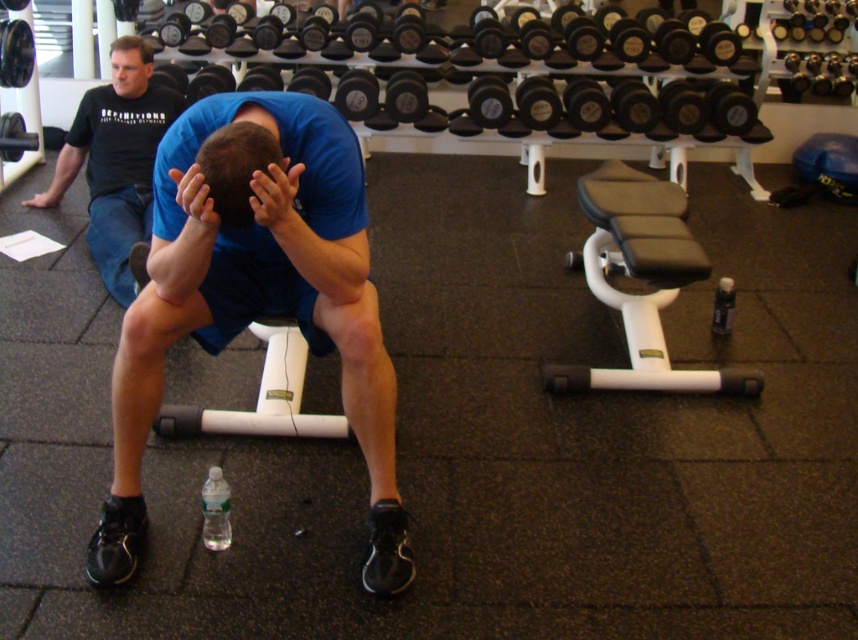
You are standing in the gym and want to place a new piece of equipment between the two points labeled as point (119, 154) and point (35, 200). Which point should the equipment be closer to if it needs to be nearer to the viewer?

The equipment should be closer to point (119, 154) since it is closer to the viewer than point (35, 200).

You are a gym trainer assessing the image. You see the black cotton shirt at upper left and the matte black hand at upper left. Which object is positioned higher in the image?

The black cotton shirt at upper left is taller than the matte black hand at upper left, so the black cotton shirt at upper left is positioned higher in the image.

You are a gym trainer assessing a client. You notice the smooth skin head at upper left and the matte skin hand at center in the image. Which object is positioned more to the left?

The smooth skin head at upper left is positioned more to the left than the matte skin hand at center.